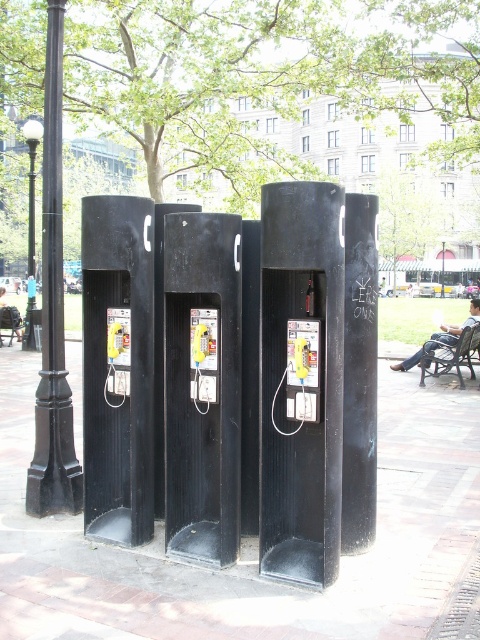
You are a visitor at the park and want to make a call using the yellow matte payphone at center. You also notice a wooden park bench at lower right nearby. Which object is taller between the two?

The wooden park bench at lower right is taller than the yellow matte payphone at center.

You are a maintenance worker who needs to reach the black polished metal pole at left and the wooden park bench at lower right. Your maintenance cart can carry a maximum load of 100 kg. If you have already loaded 80 kg of tools, how much more weight can you safely add to your cart before heading to both locations?

The black polished metal pole at left is 7.84 meters from wooden park bench at lower right. Since the distance between the two locations is known, but the question is about the cart capacity, the maximum additional weight you can safely add is 20 kg. This is calculated by subtracting the current load of 80 kg from the cart capacity of 100 kg, leaving 20 kg remaining capacity.